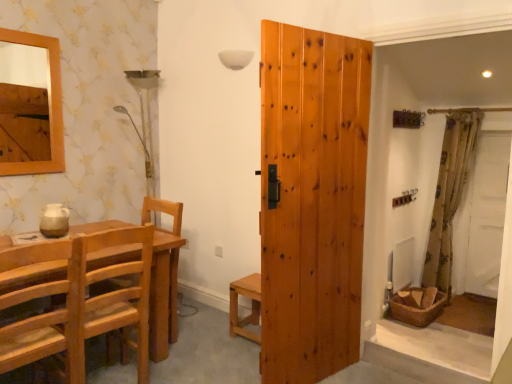
Identify the location of free space between light brown wooden stool at center and light brown wooden chair at left, placed as the 2th chair when sorted from front to back. (202, 354).